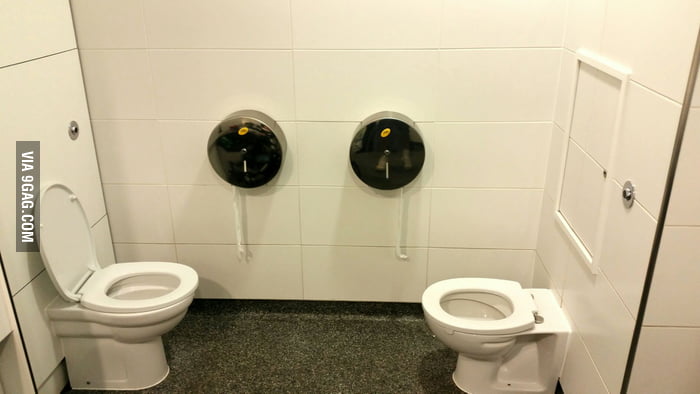
The image size is (700, 394). Find the location of `floor`. floor is located at coordinates (335, 378).